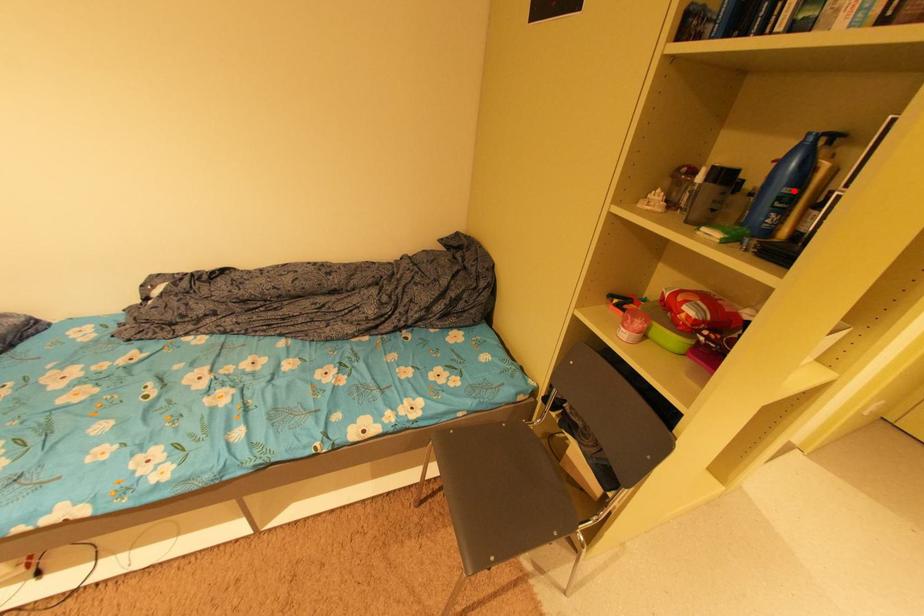
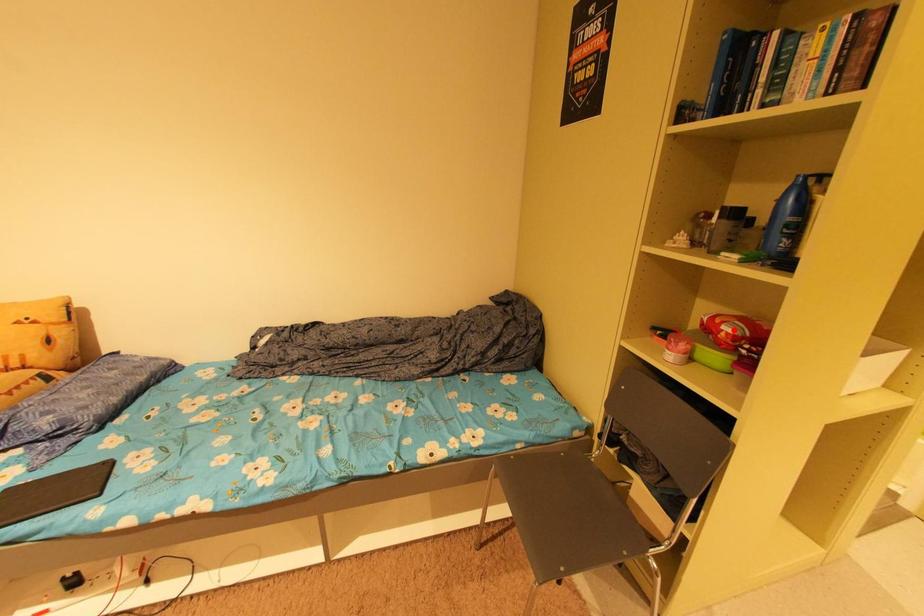
I am providing you with two images of the same scene from different viewpoints. A red point is marked on the first image and another point is marked on the second image. Do the highlighted points in image1 and image2 indicate the same real-world spot?

No